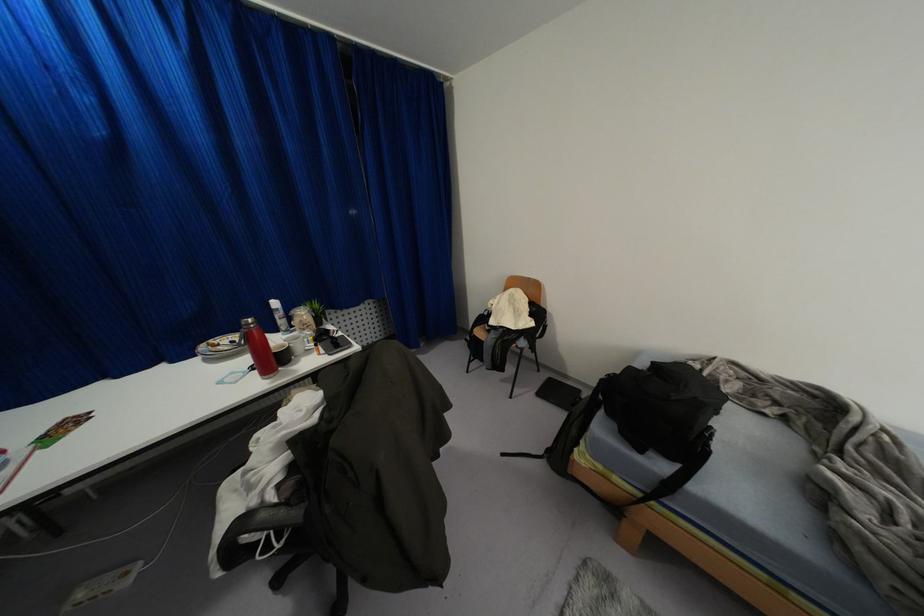
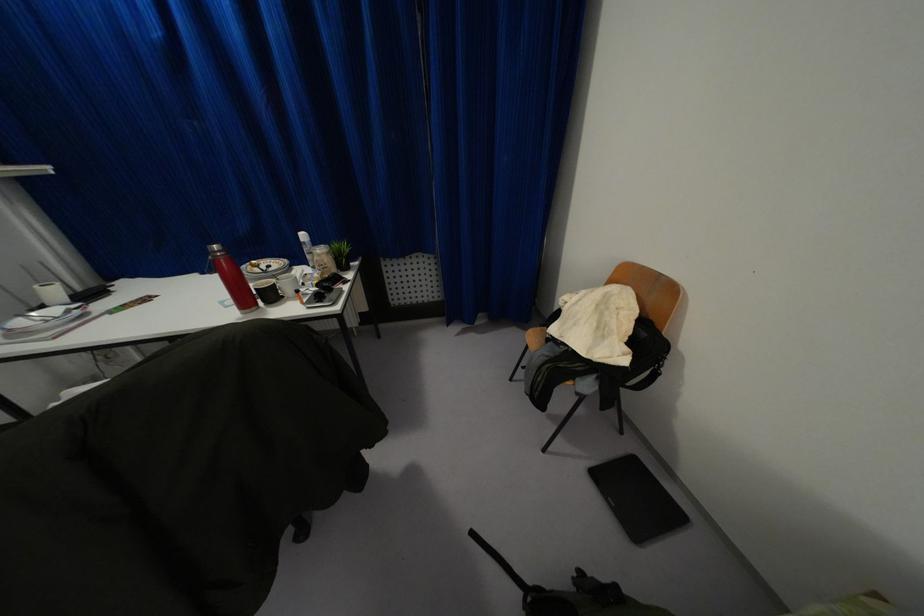
Find the pixel in the second image that matches (x=249, y=320) in the first image.

(214, 246)